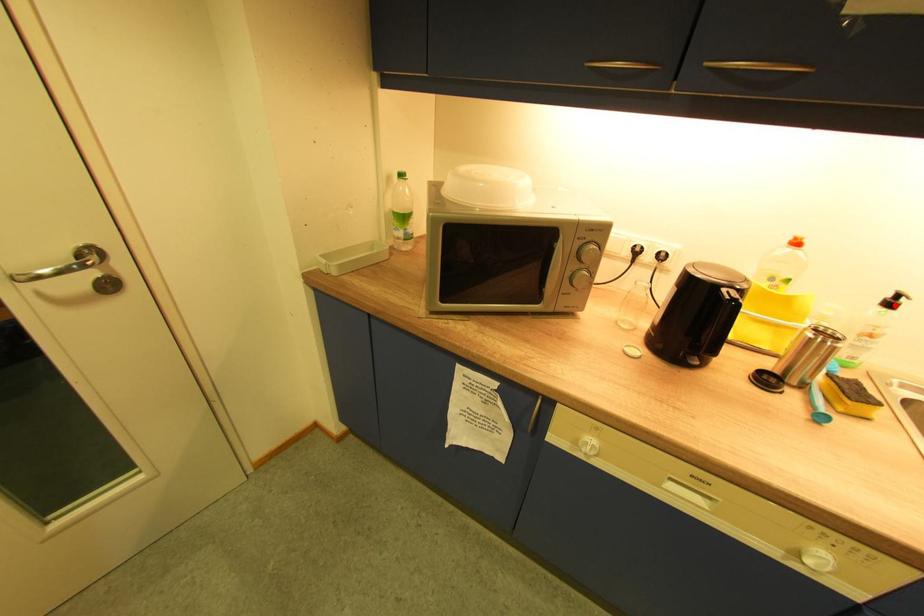
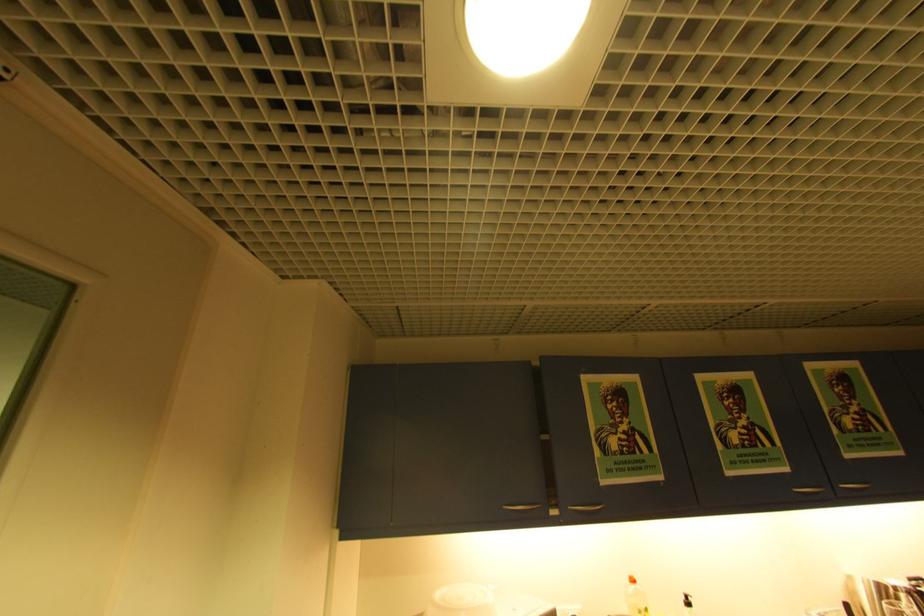
Locate, in the second image, the point that corresponds to the highlighted location in the first image.

(695, 605)